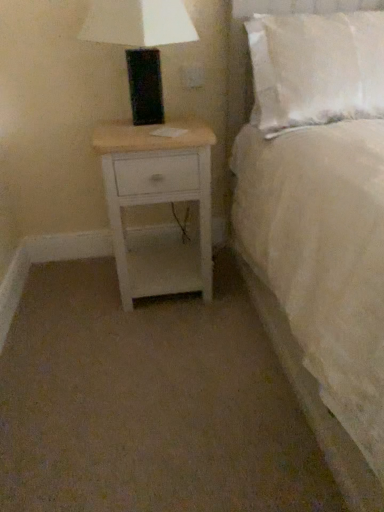
Question: Is white soft pillow at upper right aimed at white wood nightstand at lower left?

Choices:
 (A) yes
 (B) no

Answer: (B)

Question: Is white soft pillow at upper right surrounding white wood nightstand at lower left?

Choices:
 (A) no
 (B) yes

Answer: (A)

Question: Is white soft pillow at upper right thinner than white wood nightstand at lower left?

Choices:
 (A) no
 (B) yes

Answer: (B)

Question: Does white soft pillow at upper right have a greater width compared to white wood nightstand at lower left?

Choices:
 (A) yes
 (B) no

Answer: (B)

Question: Is white soft pillow at upper right completely or partially outside of white wood nightstand at lower left?

Choices:
 (A) yes
 (B) no

Answer: (A)

Question: Is white soft pillow at upper right taller than white wood nightstand at lower left?

Choices:
 (A) no
 (B) yes

Answer: (A)

Question: Would you consider white plastic outlet at upper center to be distant from white soft pillow at upper right?

Choices:
 (A) yes
 (B) no

Answer: (B)

Question: Is white plastic outlet at upper center directly adjacent to white soft pillow at upper right?

Choices:
 (A) no
 (B) yes

Answer: (A)

Question: From a real-world perspective, is white plastic outlet at upper center on top of white soft pillow at upper right?

Choices:
 (A) yes
 (B) no

Answer: (A)

Question: Considering the relative sizes of white plastic outlet at upper center and white soft pillow at upper right in the image provided, is white plastic outlet at upper center taller than white soft pillow at upper right?

Choices:
 (A) yes
 (B) no

Answer: (B)

Question: Is white plastic outlet at upper center oriented towards white soft pillow at upper right?

Choices:
 (A) yes
 (B) no

Answer: (B)

Question: Is white plastic outlet at upper center oriented away from white soft pillow at upper right?

Choices:
 (A) no
 (B) yes

Answer: (A)

Question: Is white soft bed at upper right smaller than white soft pillow at upper right?

Choices:
 (A) no
 (B) yes

Answer: (A)